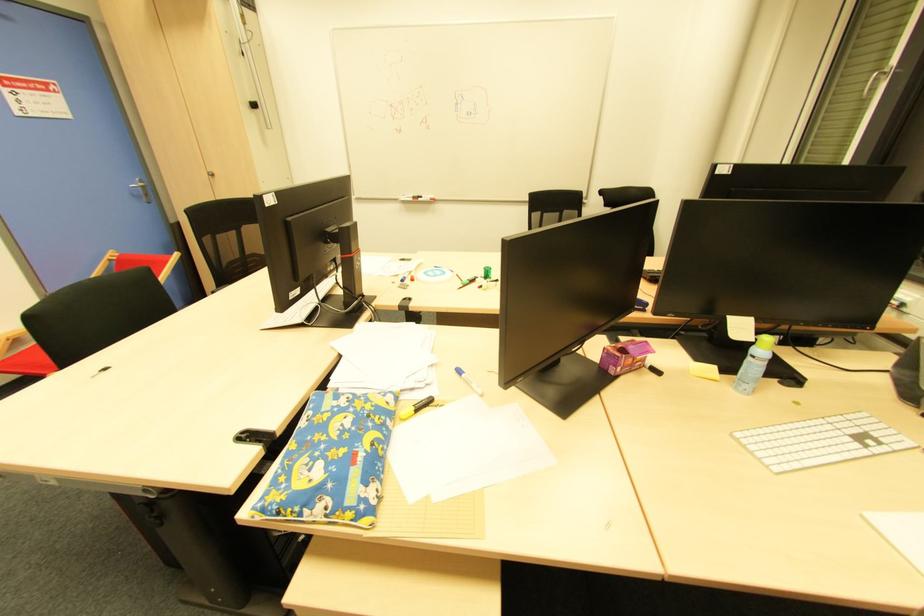
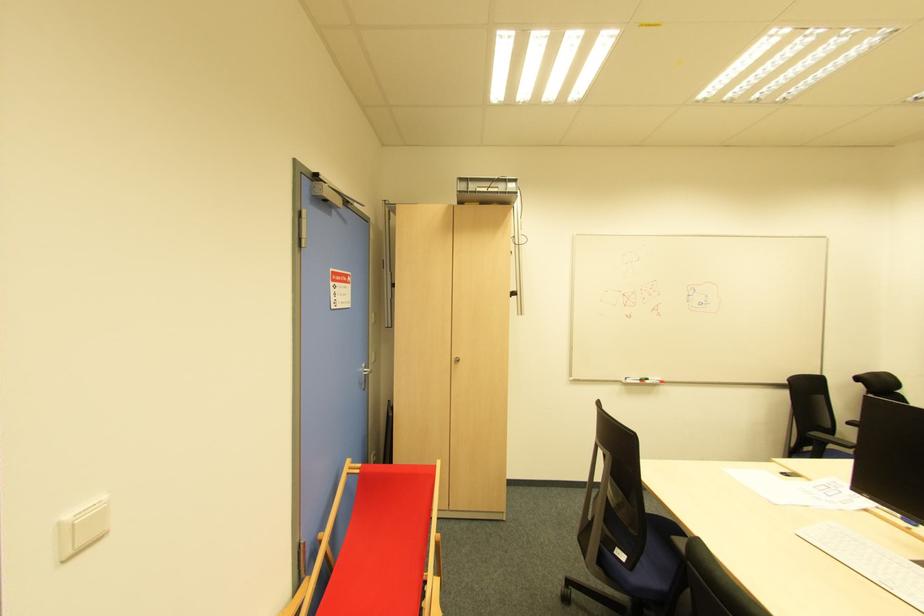
Find the pixel in the second image that matches point (419, 200) in the first image.

(647, 383)